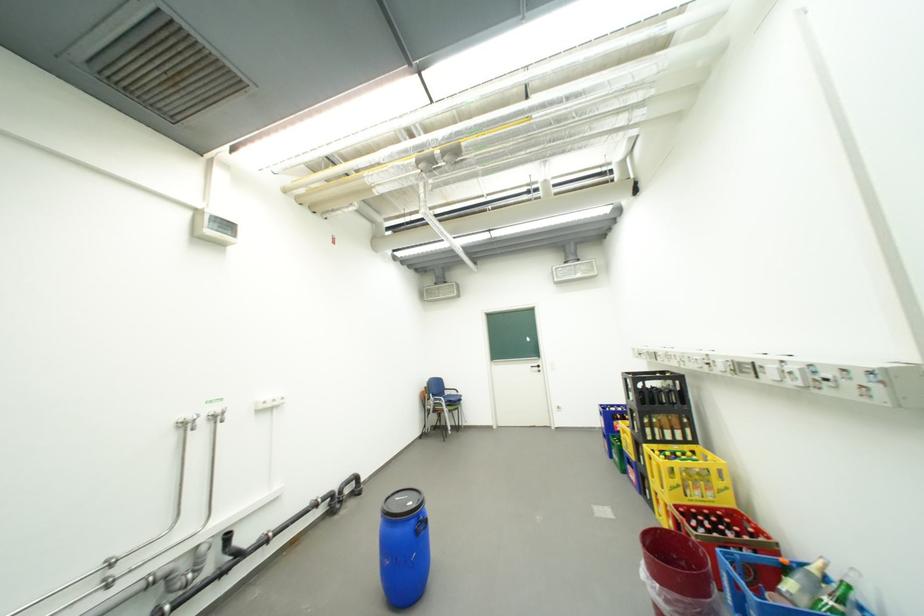
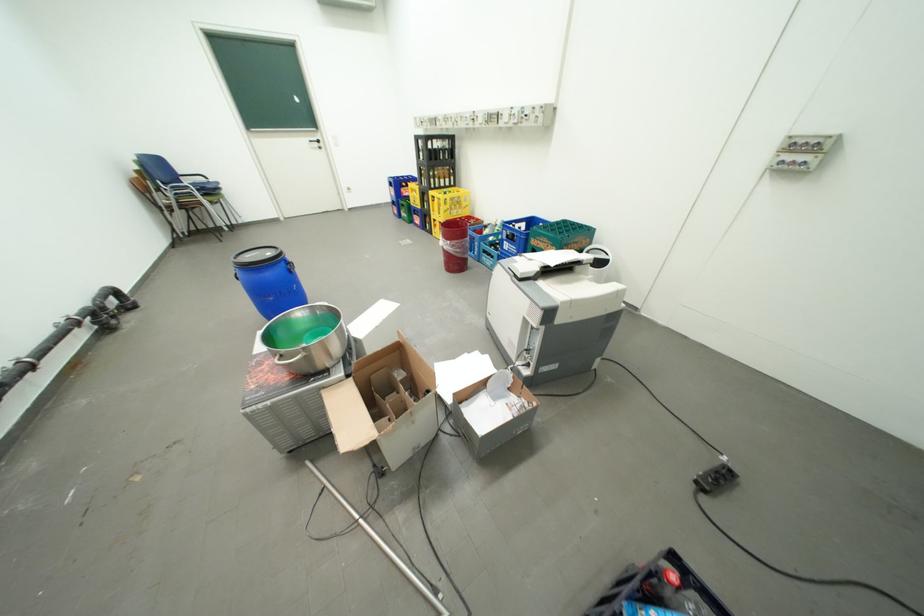
Locate, in the second image, the point that corresponds to (x=691, y=490) in the first image.

(459, 212)